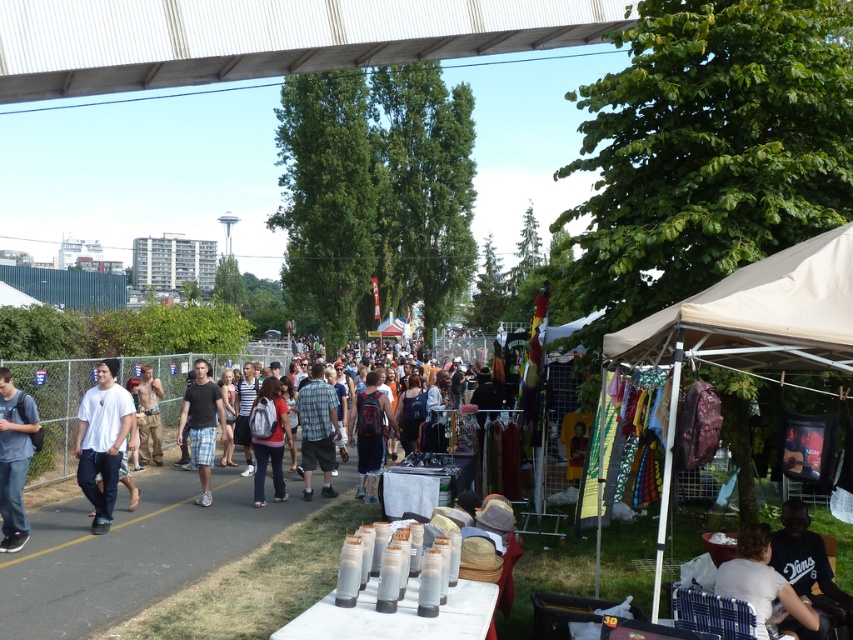
You are a customer at the market and want to visit both the beige fabric tent at right and the beige fabric canopy at right. Which one should you approach first if you want to start from the leftmost stall?

The beige fabric tent at right is positioned on the left side of beige fabric canopy at right, so you should approach the beige fabric tent at right first.